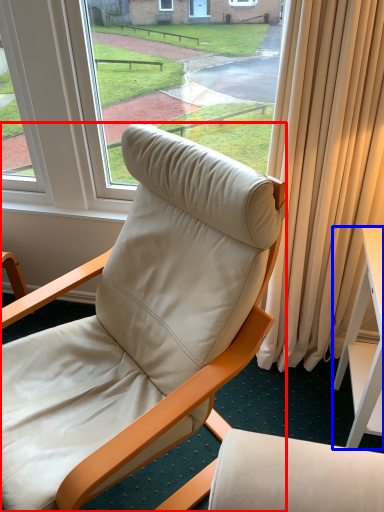
Question: Which object is closer to the camera taking this photo, chair (highlighted by a red box) or desk (highlighted by a blue box)?

Choices:
 (A) chair
 (B) desk

Answer: (A)